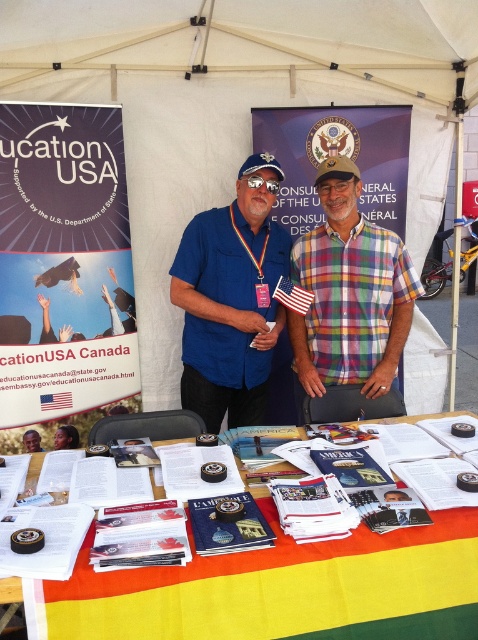
Question: Observing the image, what is the correct spatial positioning of matte paper poster at upper left in reference to paper brochures at center?

Choices:
 (A) above
 (B) below

Answer: (A)

Question: Which point is farther to the camera?

Choices:
 (A) (76, 445)
 (B) (32, 442)

Answer: (A)

Question: Is matte paper poster at upper left behind matte blue shirt at center?

Choices:
 (A) no
 (B) yes

Answer: (B)

Question: Which of the following is the closest to the observer?

Choices:
 (A) (225, 371)
 (B) (37, 444)
 (C) (408, 42)

Answer: (A)

Question: Which of the following is the closest to the observer?

Choices:
 (A) (71, 637)
 (B) (192, 182)

Answer: (A)

Question: From the image, what is the correct spatial relationship of paper brochures at center in relation to matte blue shirt at center?

Choices:
 (A) below
 (B) above

Answer: (A)